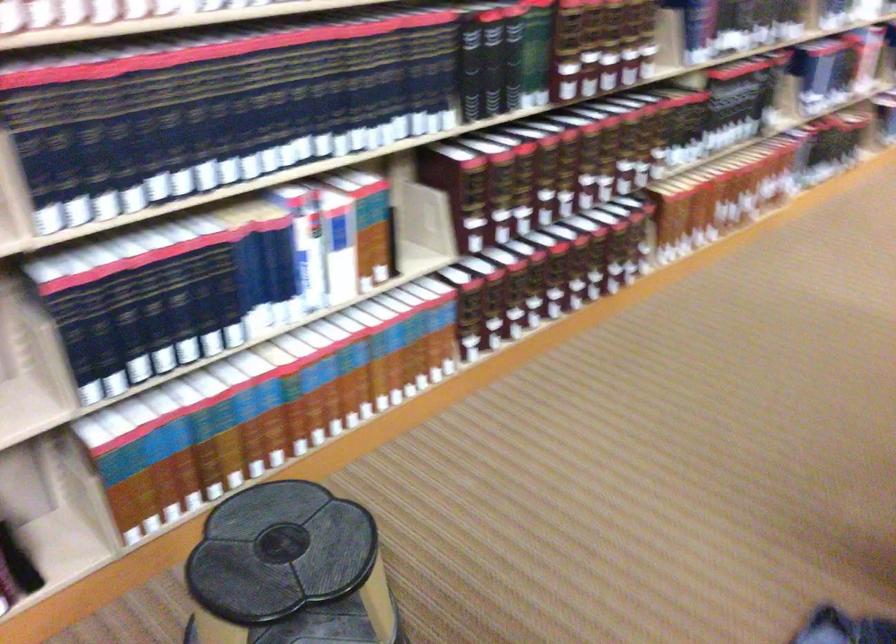
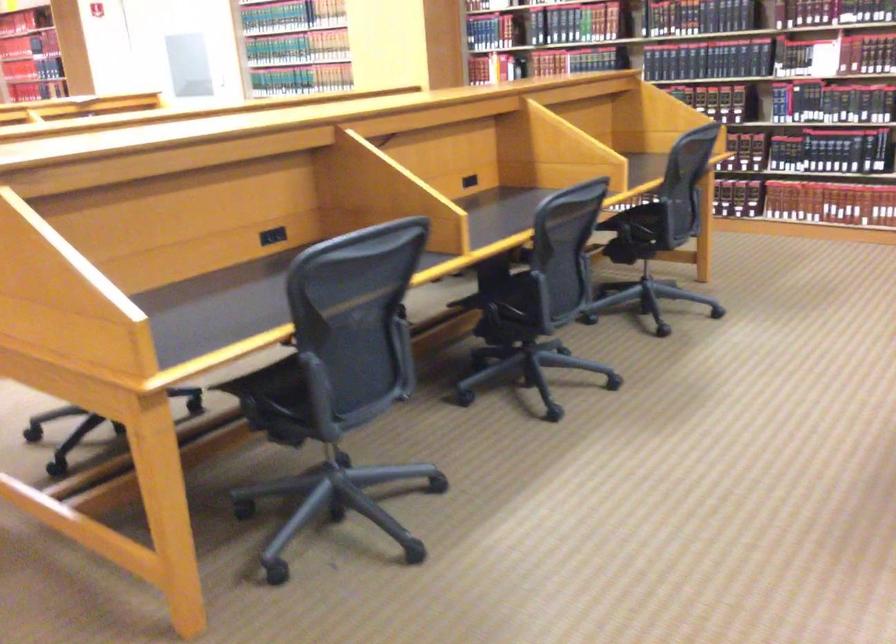
In the second image, find the point that corresponds to (x=688, y=202) in the first image.

(734, 173)